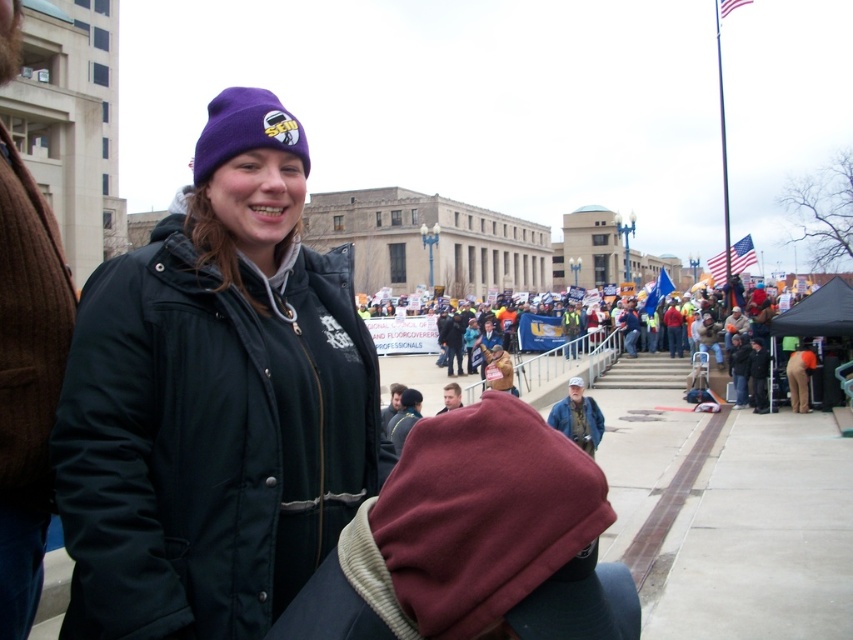
Is matte black jacket at center closer to camera compared to purple fleece beanie at upper center?

Yes.

The width and height of the screenshot is (853, 640). What do you see at coordinates (215, 401) in the screenshot? I see `matte black jacket at center` at bounding box center [215, 401].

I want to click on matte black jacket at center, so click(x=215, y=401).

Is matte black jacket at center positioned behind yellow reflective vests at center?

No, it is in front of yellow reflective vests at center.

Does matte black jacket at center have a lesser width compared to yellow reflective vests at center?

Indeed, matte black jacket at center has a lesser width compared to yellow reflective vests at center.

Between point (158, 332) and point (572, 371), which one is positioned behind?

Positioned behind is point (572, 371).

You are a GUI agent. You are given a task and a screenshot of the screen. Output one action in this format:
    pyautogui.click(x=<x>, y=<y>)
    Task: Click on the matte black jacket at center
    
    Given the screenshot: What is the action you would take?
    pyautogui.click(x=215, y=401)

Is point (303, 156) behind point (538, 356)?

No, (303, 156) is in front of (538, 356).

Does purple fleece beanie at upper center appear on the left side of yellow reflective vests at center?

Correct, you'll find purple fleece beanie at upper center to the left of yellow reflective vests at center.

Does point (207, 147) come farther from viewer compared to point (599, 355)?

No, it is not.

Find the location of a particular element. purple fleece beanie at upper center is located at coordinates (245, 131).